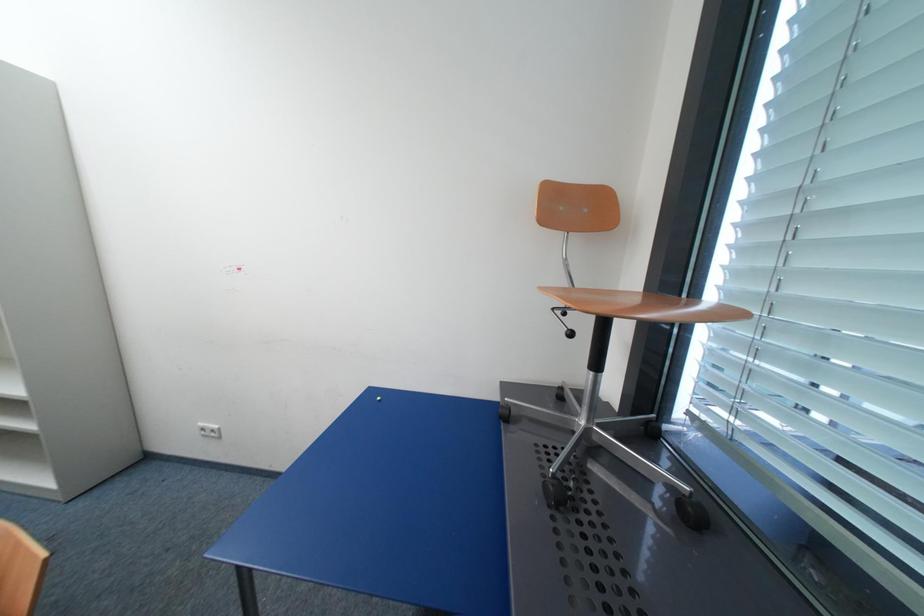
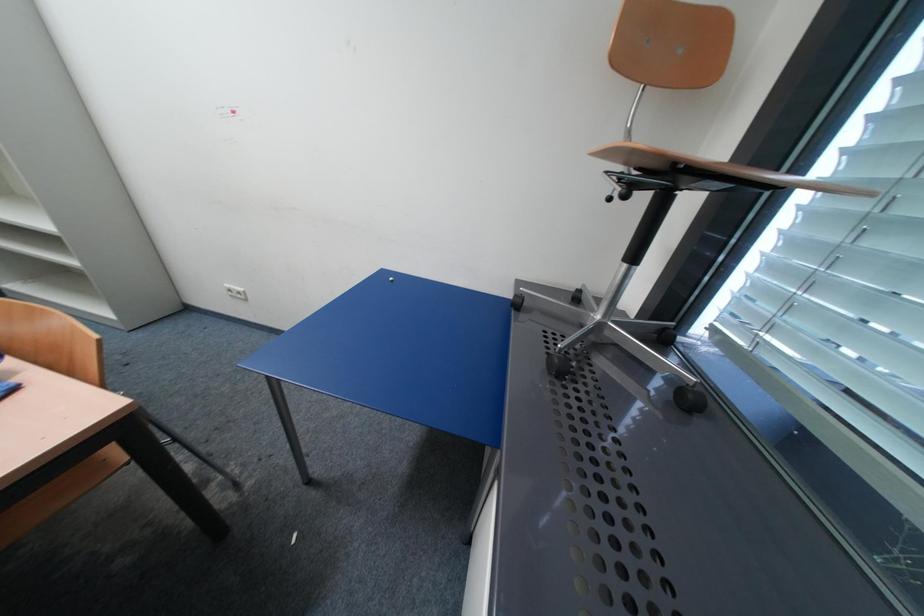
Question: Based on the continuous images, in which direction is the camera rotating? Reply with the corresponding letter.

Choices:
 (A) Left
 (B) Right
 (C) Up
 (D) Down

Answer: (D)